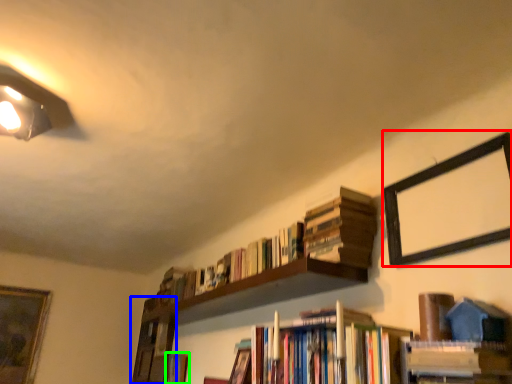
Question: Estimate the real-world distances between objects in this image. Which object is closer to picture frame (highlighted by a red box), shelf (highlighted by a blue box) or book (highlighted by a green box)?

Choices:
 (A) shelf
 (B) book

Answer: (B)